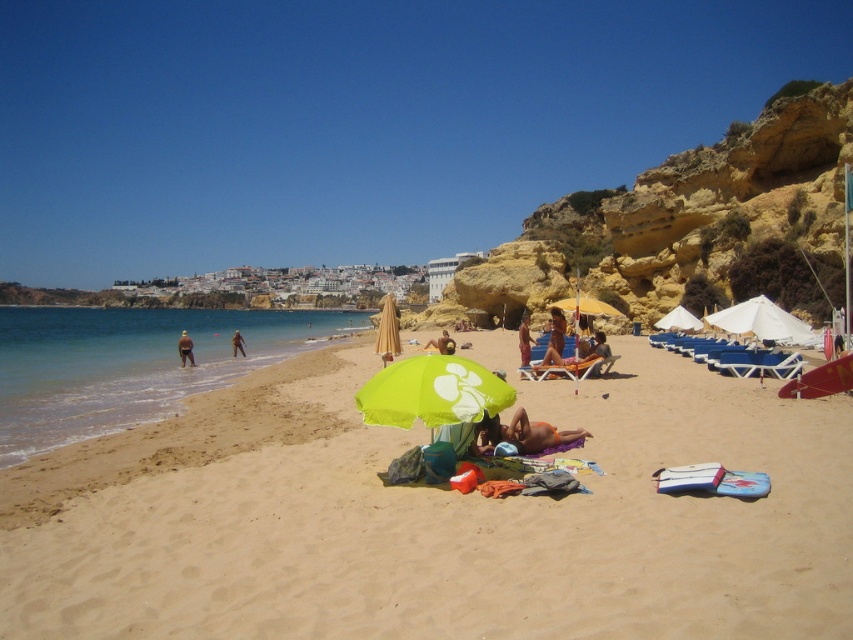
Between green fabric umbrella at center and white fabric umbrella at center-right, which one appears on the left side from the viewer's perspective?

green fabric umbrella at center

Is green fabric umbrella at center to the left of white fabric umbrella at center-right from the viewer's perspective?

Indeed, green fabric umbrella at center is positioned on the left side of white fabric umbrella at center-right.

Which is behind, point (457, 403) or point (694, 328)?

The point (694, 328) is more distant.

The height and width of the screenshot is (640, 853). What are the coordinates of `green fabric umbrella at center` in the screenshot? It's located at (432, 392).

Is point (445, 422) closer to camera compared to point (556, 349)?

Yes, it is.

Is green fabric umbrella at center positioned behind tan fabric towel at center?

No, it is in front of tan fabric towel at center.

Is point (471, 397) positioned in front of point (544, 353)?

Yes, point (471, 397) is closer to viewer.

Locate an element on the screen. Image resolution: width=853 pixels, height=640 pixels. green fabric umbrella at center is located at coordinates (432, 392).

Is point (676, 330) closer to camera compared to point (433, 348)?

That is True.

Between white fabric umbrella at center-right and smooth tan skin at center, which one appears on the left side from the viewer's perspective?

Positioned to the left is smooth tan skin at center.

The width and height of the screenshot is (853, 640). I want to click on white fabric umbrella at center-right, so click(679, 321).